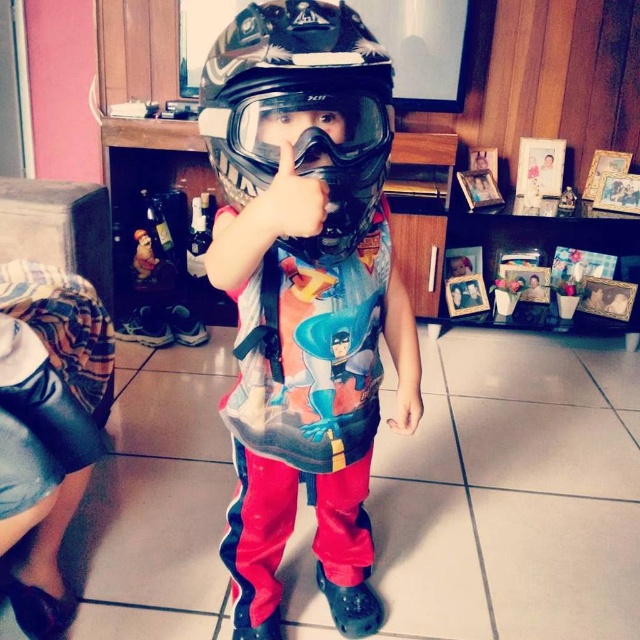
Does matte black helmet at center have a smaller size compared to camouflage matte helmet at center?

No, matte black helmet at center is not smaller than camouflage matte helmet at center.

Can you confirm if matte black helmet at center is bigger than camouflage matte helmet at center?

Indeed, matte black helmet at center has a larger size compared to camouflage matte helmet at center.

Is point (232, 252) in front of point (257, 24)?

Yes, it is.

Locate an element on the screen. matte black helmet at center is located at coordinates (305, 294).